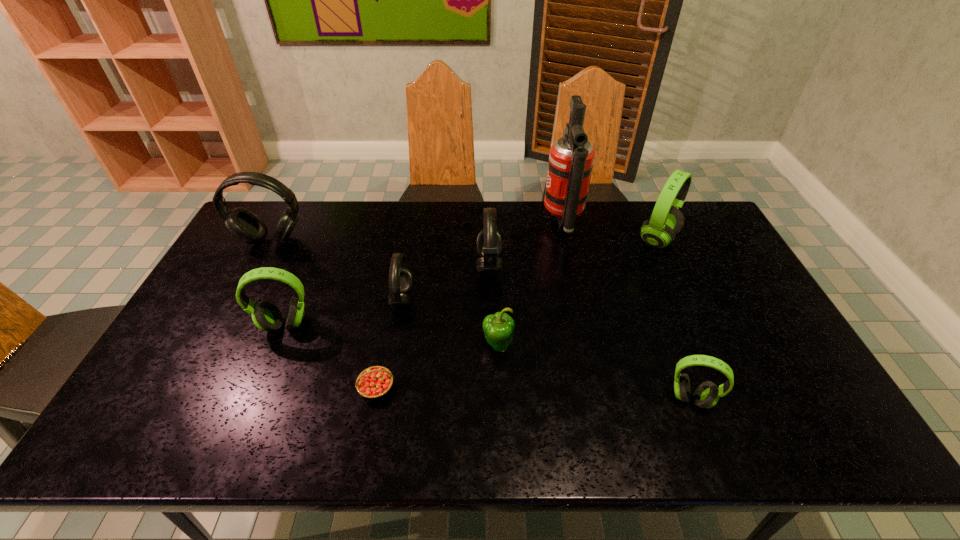
This screenshot has width=960, height=540. Identify the location of the nearest green headset. (707, 394).

Where is `the smallest green headset`? The width and height of the screenshot is (960, 540). the smallest green headset is located at coordinates (707, 394).

At what (x,y) coordinates should I click in order to perform the action: click on bell pepper. Please return your answer as a coordinate pair (x, y). Image resolution: width=960 pixels, height=540 pixels. Looking at the image, I should click on (498, 328).

At what (x,y) coordinates should I click in order to perform the action: click on brown strawberry. Please return your answer as a coordinate pair (x, y). This screenshot has width=960, height=540. Looking at the image, I should click on (374, 382).

The image size is (960, 540). Find the location of `the shortest object`. the shortest object is located at coordinates (374, 382).

Find the location of a particular element. The width and height of the screenshot is (960, 540). vacant space located on the front label side of the fire extinguisher is located at coordinates (491, 221).

Find the location of a particular element. The height and width of the screenshot is (540, 960). vacant area situated on the front label side of the fire extinguisher is located at coordinates (520, 221).

Where is `free location located 0.300m on the front label side of the fire extinguisher`? free location located 0.300m on the front label side of the fire extinguisher is located at coordinates (460, 221).

Identify the location of free location located 0.360m on the front of the farthest green headset. Image resolution: width=960 pixels, height=540 pixels. (707, 345).

Identify the location of free spot located 0.220m on the earcups of the biggest gray headset. (240, 298).